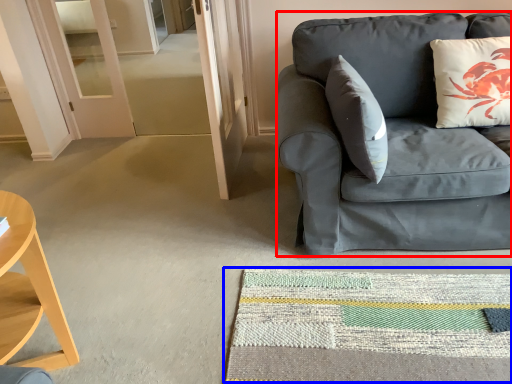
Question: Among these objects, which one is farthest to the camera, studio couch (highlighted by a red box) or mat (highlighted by a blue box)?

Choices:
 (A) studio couch
 (B) mat

Answer: (A)